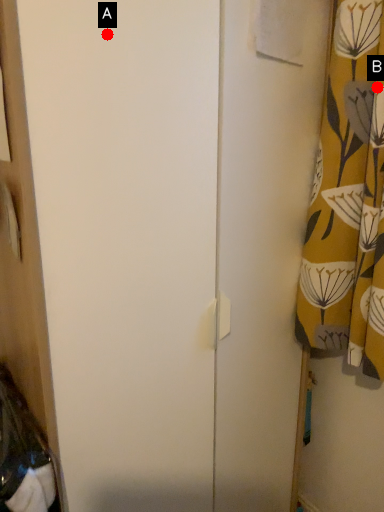
Question: Two points are circled on the image, labeled by A and B beside each circle. Which point is closer to the camera taking this photo?

Choices:
 (A) A is closer
 (B) B is closer

Answer: (A)